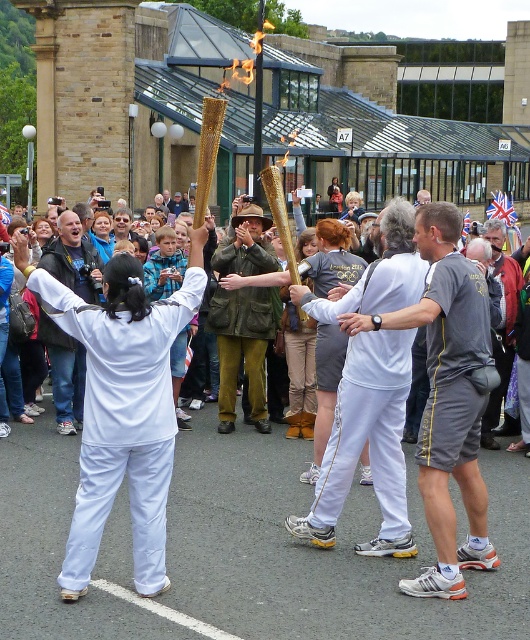
You are standing at the starting point of the torch relay and see the gold metallic torch at center. If you need to hand over the torch to the next bearer who is 7 meters away from you, can you reach them by just walking forward without passing the torch to anyone else?

The gold metallic torch at center is 7.15 meters away from the viewer. Since the next bearer is 7 meters away, you cannot reach them by just walking forward as the distance is slightly more than 7 meters.